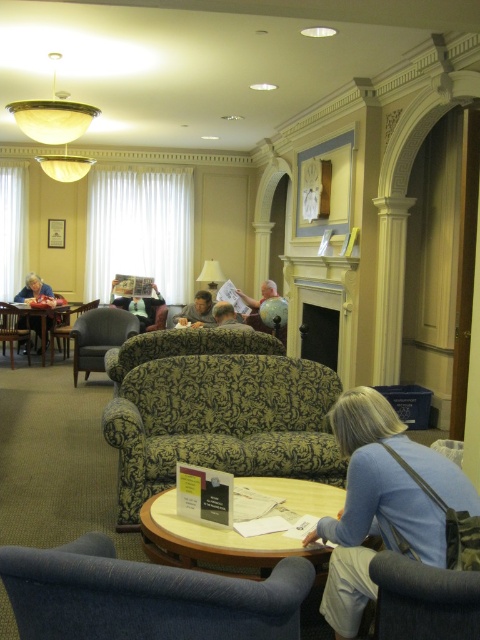
Question: Is dark gray fabric chair at lower right thinner than matte gray shirt at center?

Choices:
 (A) no
 (B) yes

Answer: (B)

Question: Among these objects, which one is farthest from the camera?

Choices:
 (A) matte black armchair at left
 (B) blue fabric armchair at lower left
 (C) white glossy round table at center
 (D) wooden table at left

Answer: (A)

Question: Is blue fabric armchair at lower left bigger than white glossy round table at center?

Choices:
 (A) no
 (B) yes

Answer: (A)

Question: Does dark green fabric armchair at center have a smaller size compared to gray fabric couch at center?

Choices:
 (A) no
 (B) yes

Answer: (A)

Question: Which point appears farthest from the camera in this image?

Choices:
 (A) (268, 292)
 (B) (324, 496)

Answer: (A)

Question: Among these objects, which one is nearest to the camera?

Choices:
 (A) dark green fabric armchair at center
 (B) matte black jacket at left
 (C) matte gray shirt at center

Answer: (C)